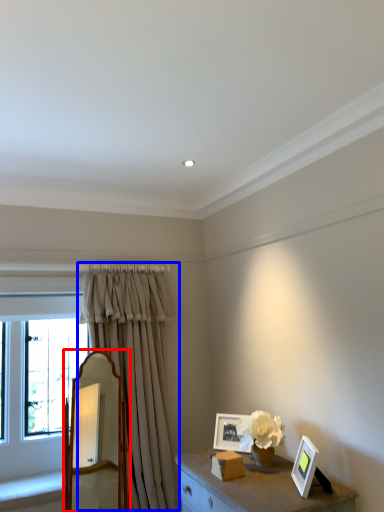
Question: Among these objects, which one is nearest to the camera, mirror (highlighted by a red box) or curtain (highlighted by a blue box)?

Choices:
 (A) mirror
 (B) curtain

Answer: (A)